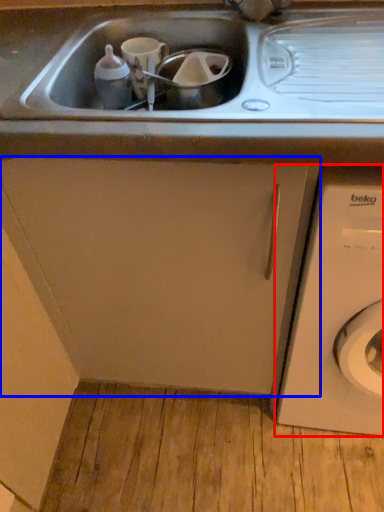
Question: Which of the following is the closest to the observer, washing machine (highlighted by a red box) or cabinetry (highlighted by a blue box)?

Choices:
 (A) washing machine
 (B) cabinetry

Answer: (A)